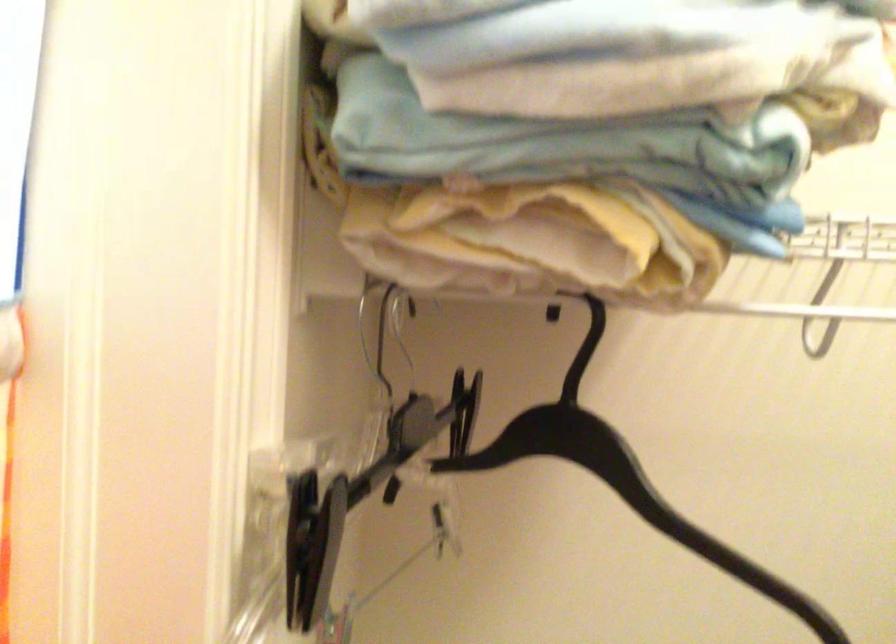
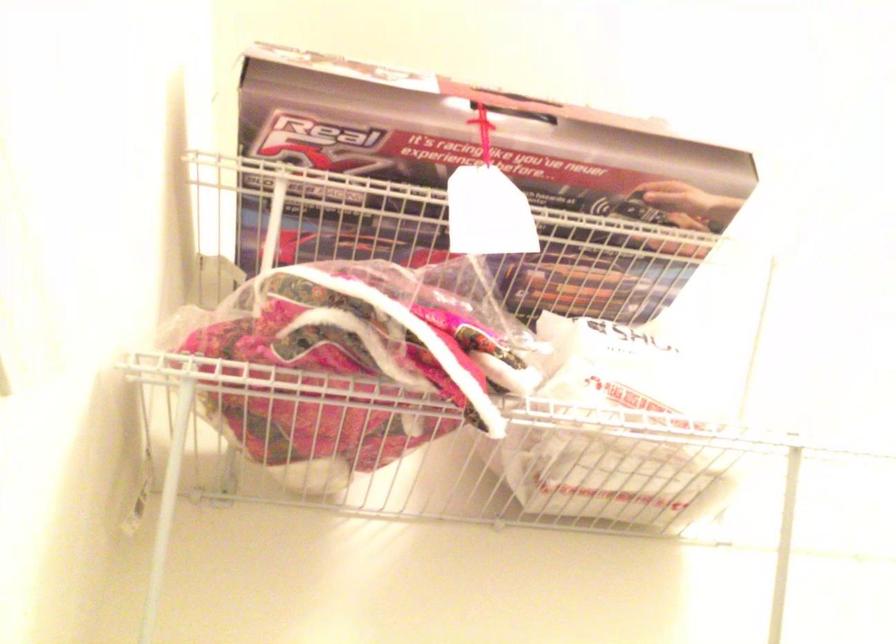
The first image is from the beginning of the video and the second image is from the end. How did the camera likely rotate when shooting the video?

The rotation direction of the camera is right-up.